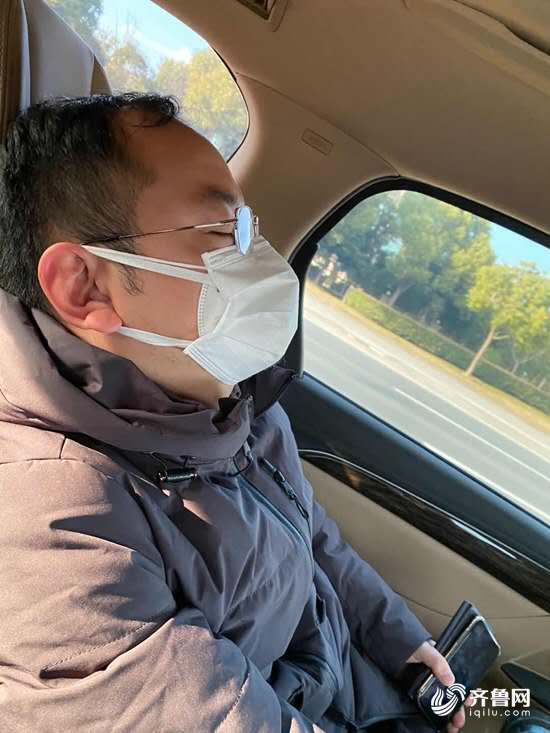
Image resolution: width=550 pixels, height=733 pixels. Identify the location of window. (434, 430).